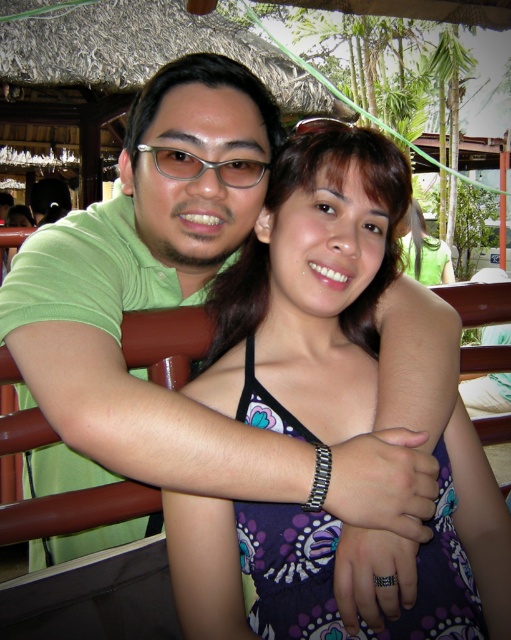
Question: Which point is farther to the camera?

Choices:
 (A) (267, 301)
 (B) (239, 168)

Answer: (A)

Question: Does purple printed dress at center appear under clear plastic glasses at upper center?

Choices:
 (A) yes
 (B) no

Answer: (A)

Question: Where is purple printed dress at center located in relation to clear plastic glasses at upper center in the image?

Choices:
 (A) left
 (B) right

Answer: (B)

Question: Does purple printed dress at center appear on the right side of clear plastic glasses at upper center?

Choices:
 (A) no
 (B) yes

Answer: (B)

Question: Among these points, which one is farthest from the camera?

Choices:
 (A) (248, 172)
 (B) (365, 376)

Answer: (B)